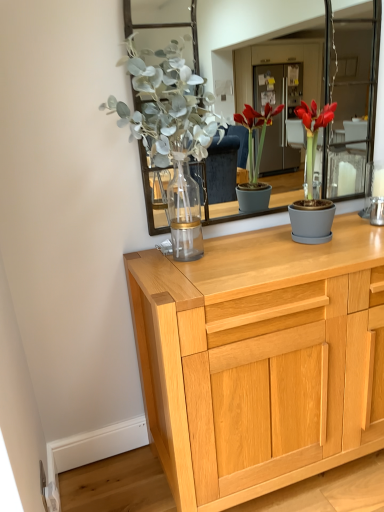
Question: Is matte gray pot at center wider or thinner than light oak wooden chest of drawers at center?

Choices:
 (A) wide
 (B) thin

Answer: (B)

Question: Considering the positions of matte gray pot at center and light oak wooden chest of drawers at center in the image, is matte gray pot at center taller or shorter than light oak wooden chest of drawers at center?

Choices:
 (A) short
 (B) tall

Answer: (A)

Question: From the image's perspective, is matte gray pot at center located above or below light oak wooden chest of drawers at center?

Choices:
 (A) below
 (B) above

Answer: (B)

Question: Is point (205, 279) positioned closer to the camera than point (324, 231)?

Choices:
 (A) closer
 (B) farther

Answer: (A)

Question: From a real-world perspective, is light oak wooden chest of drawers at center positioned above or below matte gray pot at center?

Choices:
 (A) above
 (B) below

Answer: (B)

Question: From the image's perspective, is light oak wooden chest of drawers at center positioned above or below matte gray pot at center?

Choices:
 (A) above
 (B) below

Answer: (B)

Question: Based on their positions, is light oak wooden chest of drawers at center located to the left or right of matte gray pot at center?

Choices:
 (A) left
 (B) right

Answer: (A)